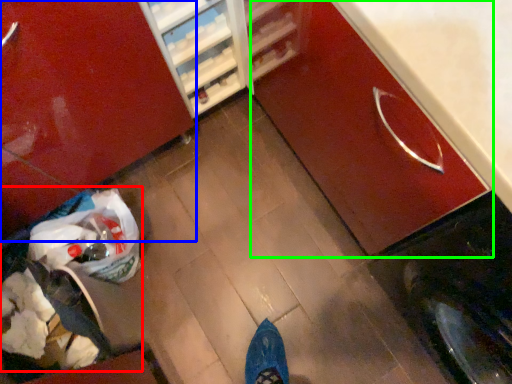
Question: Considering the real-world distances, which object is farthest from garbage (highlighted by a red box)? cabinetry (highlighted by a blue box) or cabinetry (highlighted by a green box)?

Choices:
 (A) cabinetry
 (B) cabinetry

Answer: (B)